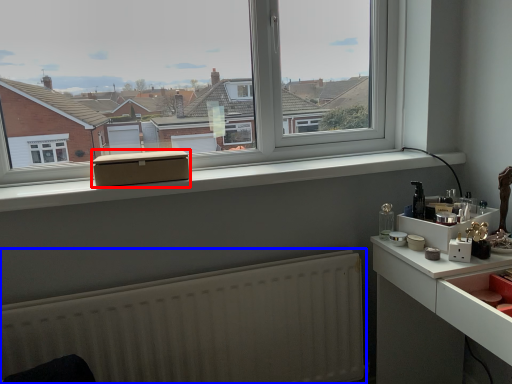
Question: Which point is closer to the camera, box (highlighted by a red box) or radiator (highlighted by a blue box)?

Choices:
 (A) box
 (B) radiator

Answer: (B)